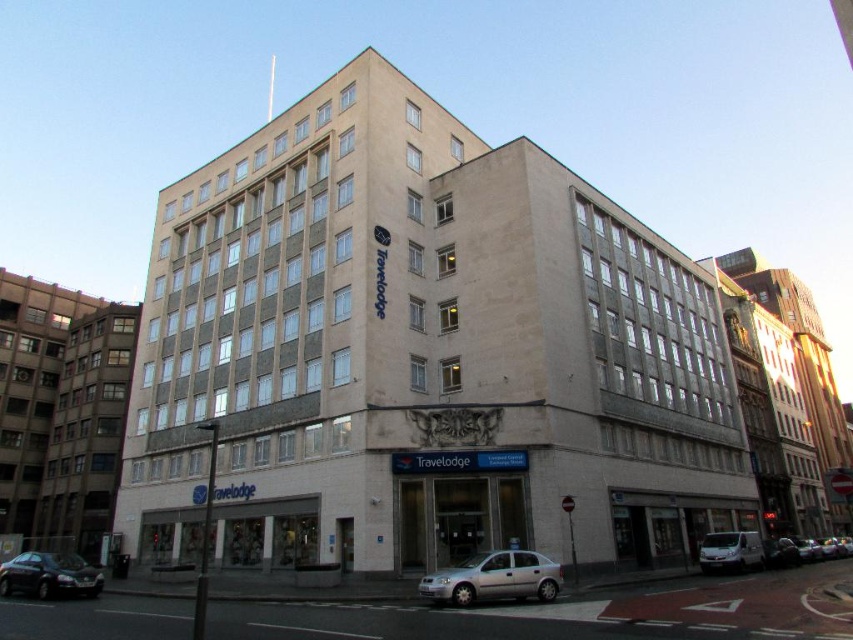
Identify the location of silver metallic car at lower center. The width and height of the screenshot is (853, 640). (494, 579).

Between point (445, 570) and point (20, 577), which one is positioned behind?

The point (445, 570) is more distant.

Where is `silver metallic car at lower center`? Image resolution: width=853 pixels, height=640 pixels. silver metallic car at lower center is located at coordinates pos(494,579).